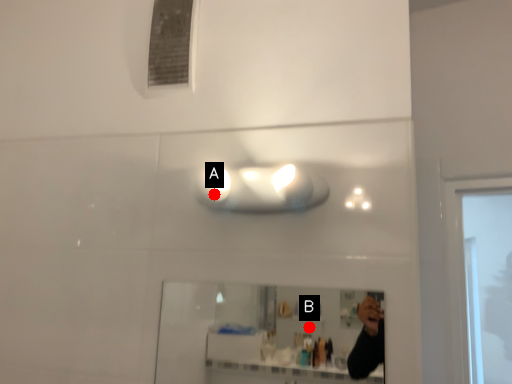
Question: Two points are circled on the image, labeled by A and B beside each circle. Which point appears closest to the camera in this image?

Choices:
 (A) A is closer
 (B) B is closer

Answer: (A)